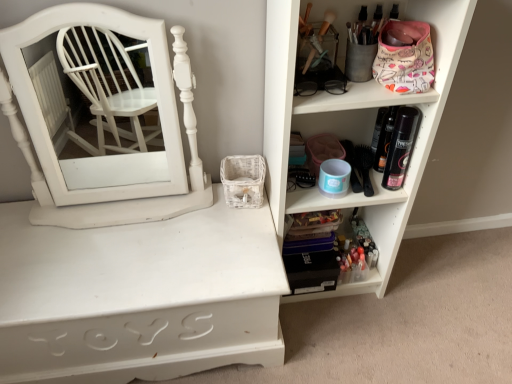
The image size is (512, 384). Find the location of `vacant space situated above white painted wood shelf at center, which is counted as the 3th shelf, starting from the right (from a real-world perspective)`. vacant space situated above white painted wood shelf at center, which is counted as the 3th shelf, starting from the right (from a real-world perspective) is located at coordinates (124, 238).